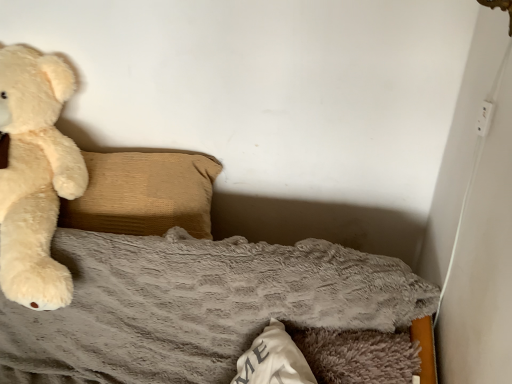
What is the approximate width of beige textured pillow at left?

beige textured pillow at left is 9.71 inches wide.

At what (x,y) coordinates should I click in order to perform the action: click on beige textured pillow at left. Please return your answer as a coordinate pair (x, y). The height and width of the screenshot is (384, 512). Looking at the image, I should click on (144, 194).

What do you see at coordinates (144, 194) in the screenshot? The image size is (512, 384). I see `beige textured pillow at left` at bounding box center [144, 194].

You are a GUI agent. You are given a task and a screenshot of the screen. Output one action in this format:
    pyautogui.click(x=<x>, y=<y>)
    Task: Click on the beige textured pillow at left
    Image resolution: width=512 pixels, height=384 pixels.
    Given the screenshot: What is the action you would take?
    pyautogui.click(x=144, y=194)